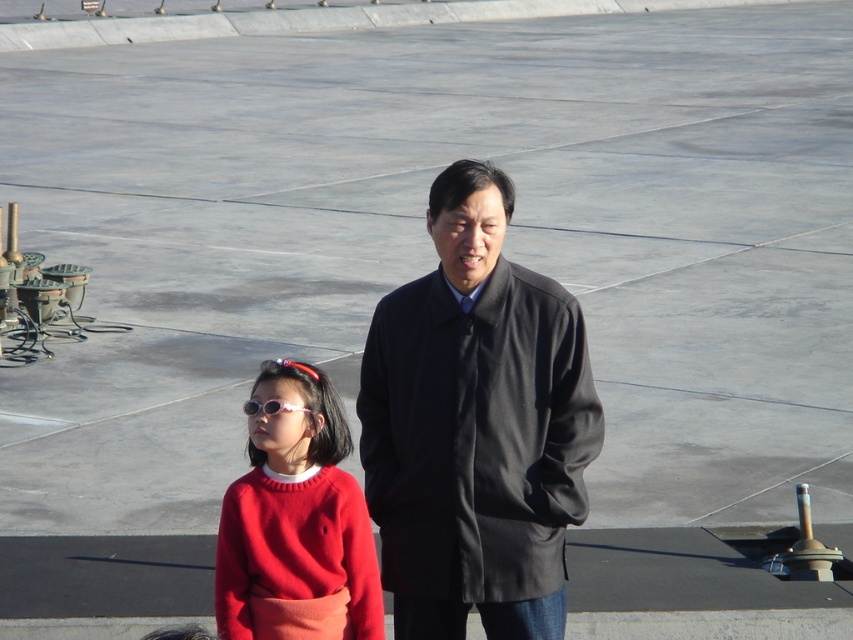
Question: Is dark gray woolen coat at center above pink shiny sunglasses at center?

Choices:
 (A) yes
 (B) no

Answer: (B)

Question: Which object is the closest to the matte red sweater at center?

Choices:
 (A) pink shiny sunglasses at center
 (B) dark gray woolen coat at center

Answer: (A)

Question: Observing the image, what is the correct spatial positioning of dark gray woolen coat at center in reference to matte red sweater at center?

Choices:
 (A) above
 (B) below

Answer: (A)

Question: Which of the following is the closest to the observer?

Choices:
 (A) (306, 408)
 (B) (349, 497)

Answer: (B)

Question: Which object is the farthest from the pink shiny sunglasses at center?

Choices:
 (A) matte red sweater at center
 (B) dark gray woolen coat at center

Answer: (B)

Question: Does dark gray woolen coat at center have a larger size compared to matte red sweater at center?

Choices:
 (A) yes
 (B) no

Answer: (A)